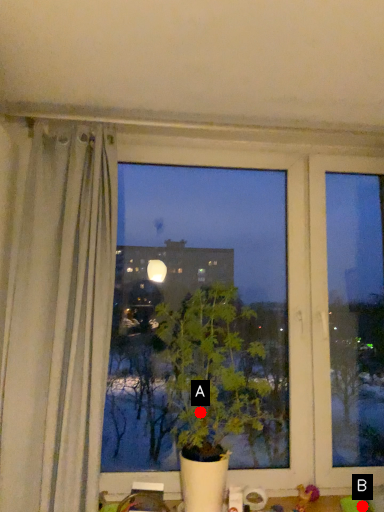
Question: Two points are circled on the image, labeled by A and B beside each circle. Among these points, which one is nearest to the camera?

Choices:
 (A) A is closer
 (B) B is closer

Answer: (A)